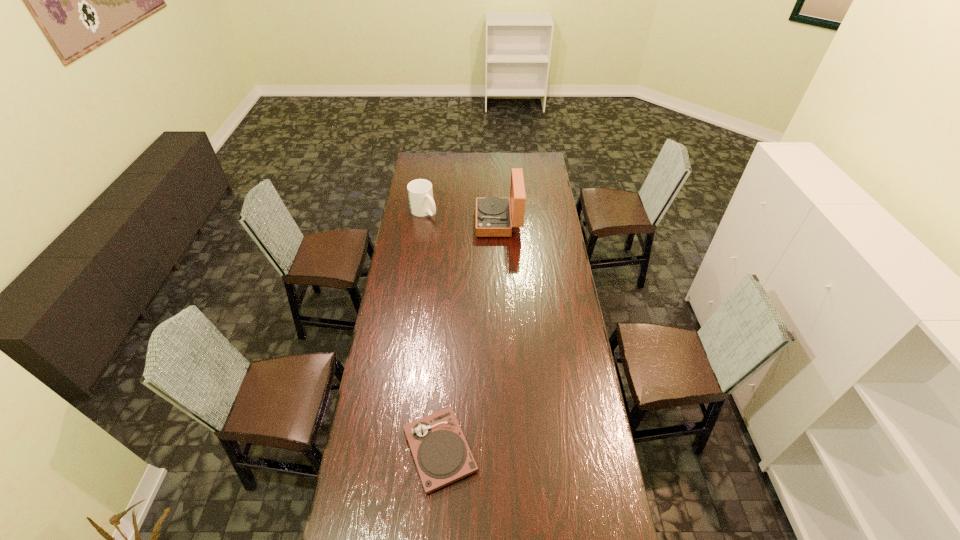
The image size is (960, 540). I want to click on free space between the nearest object and the mug, so click(x=432, y=331).

At what (x,y) coordinates should I click in order to perform the action: click on empty space that is in between the mug and the shortest object. Please return your answer as a coordinate pair (x, y). The image size is (960, 540). Looking at the image, I should click on (432, 331).

Where is `vacant area that lies between the taller phonograph_record and the shorter phonograph_record`? The height and width of the screenshot is (540, 960). vacant area that lies between the taller phonograph_record and the shorter phonograph_record is located at coordinates (469, 336).

This screenshot has width=960, height=540. What are the coordinates of `unoccupied position between the taller phonograph_record and the mug` in the screenshot? It's located at (461, 217).

The height and width of the screenshot is (540, 960). Identify the location of free space that is in between the shorter phonograph_record and the second shortest object. [x=432, y=331].

Identify which object is the nearest to the farther phonograph_record. Please provide its 2D coordinates. Your answer should be formatted as a tuple, i.e. [(x, y)], where the tuple contains the x and y coordinates of a point satisfying the conditions above.

[(420, 193)]

Select which object is the second closest to the mug. Please provide its 2D coordinates. Your answer should be formatted as a tuple, i.e. [(x, y)], where the tuple contains the x and y coordinates of a point satisfying the conditions above.

[(441, 453)]